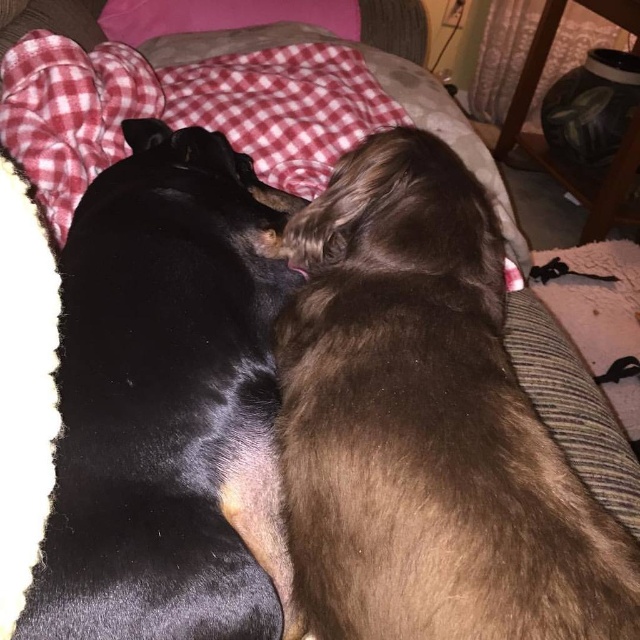
You are a pet sitter and need to ensure both dogs have enough space on the red plaid blanket at upper left. Given that the black soft fur dog at center is currently occupying less space than the blanket, can the other dog also fit comfortably on the same blanket?

The black soft fur dog at center occupies less space than the red plaid blanket at upper left, so there is enough room for the other dog to also fit comfortably on the same blanket.

You are trying to determine if the brown fluffy dog at upper center is covered by the red plaid blanket at upper left. Based on the scene description, can you confirm if the blanket is over the dog?

The brown fluffy dog at upper center is positioned under the red plaid blanket at upper left, so yes, the blanket is covering the dog.

You are trying to determine the arrangement of the dogs and the blanket in the image. Based on the scene, which object is closer to you between the brown fluffy dog at upper center and the red plaid blanket at upper left?

The brown fluffy dog at upper center is closer to you because it is positioned in front of the red plaid blanket at upper left.